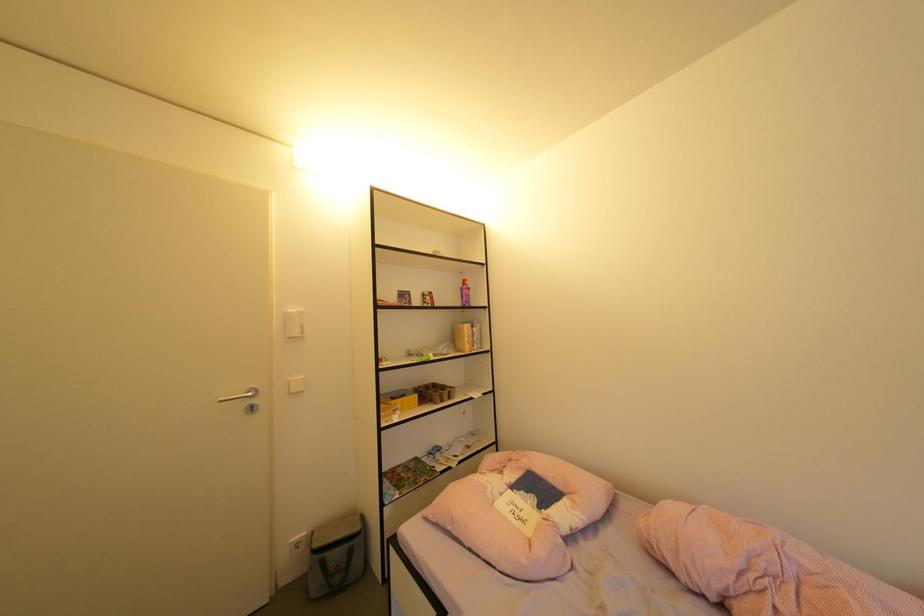
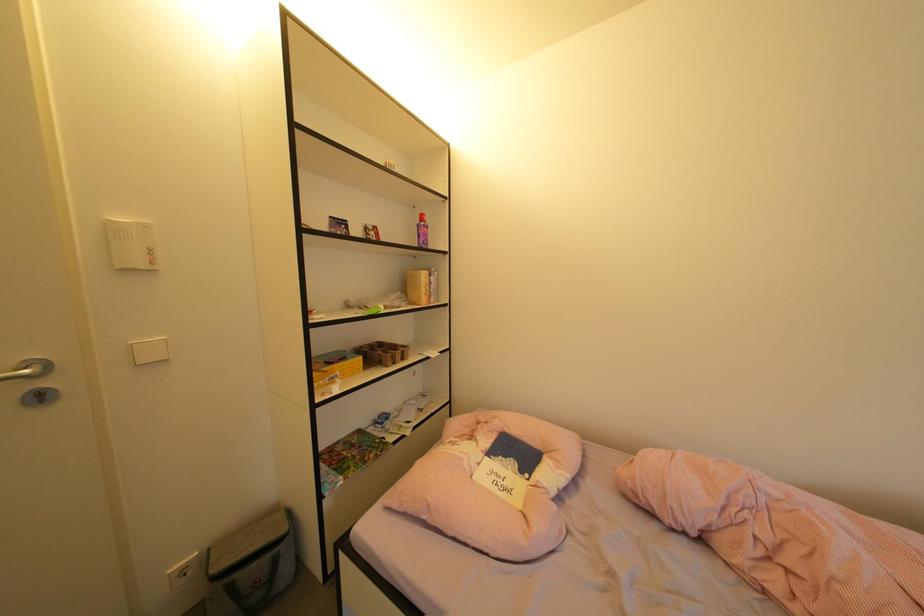
Question: The images are taken continuously from a first-person perspective. In which direction is your viewpoint rotating?

Choices:
 (A) Left
 (B) Right
 (C) Up
 (D) Down

Answer: (B)